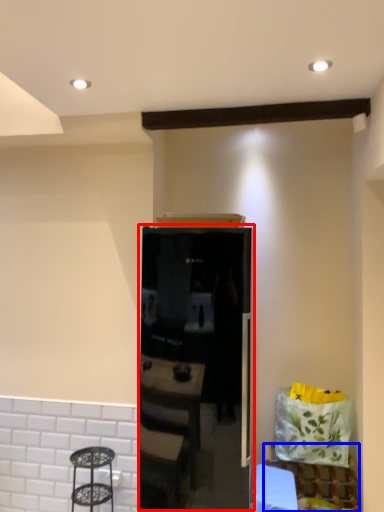
Question: Which point is further to the camera, appliance (highlighted by a red box) or furniture (highlighted by a blue box)?

Choices:
 (A) appliance
 (B) furniture

Answer: (B)